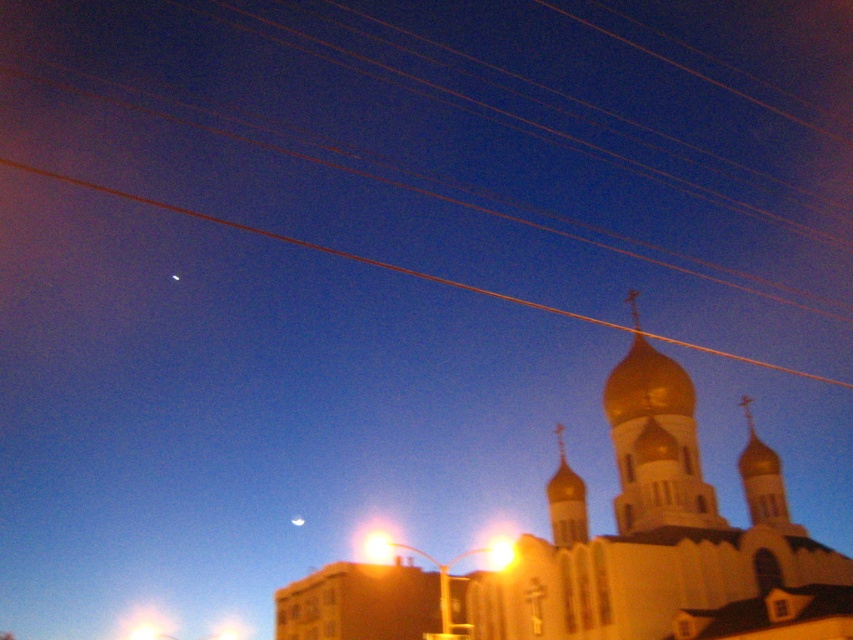
Question: Does orange wire at upper center have a lesser width compared to bright silver sphere at upper center?

Choices:
 (A) yes
 (B) no

Answer: (B)

Question: Among these points, which one is nearest to the camera?

Choices:
 (A) (648, 630)
 (B) (300, 525)
 (C) (561, 496)

Answer: (A)

Question: Among these objects, which one is nearest to the camera?

Choices:
 (A) yellow glass streetlight at center
 (B) gold domed spire at upper center

Answer: (B)

Question: Can you confirm if bright yellow light at upper center is positioned to the right of bright silver sphere at upper center?

Choices:
 (A) no
 (B) yes

Answer: (B)

Question: Which of the following is the farthest from the observer?

Choices:
 (A) yellow glass streetlight at center
 (B) gold domed church at center

Answer: (A)

Question: Is gold domed church at center bigger than bright yellow light at upper center?

Choices:
 (A) no
 (B) yes

Answer: (B)